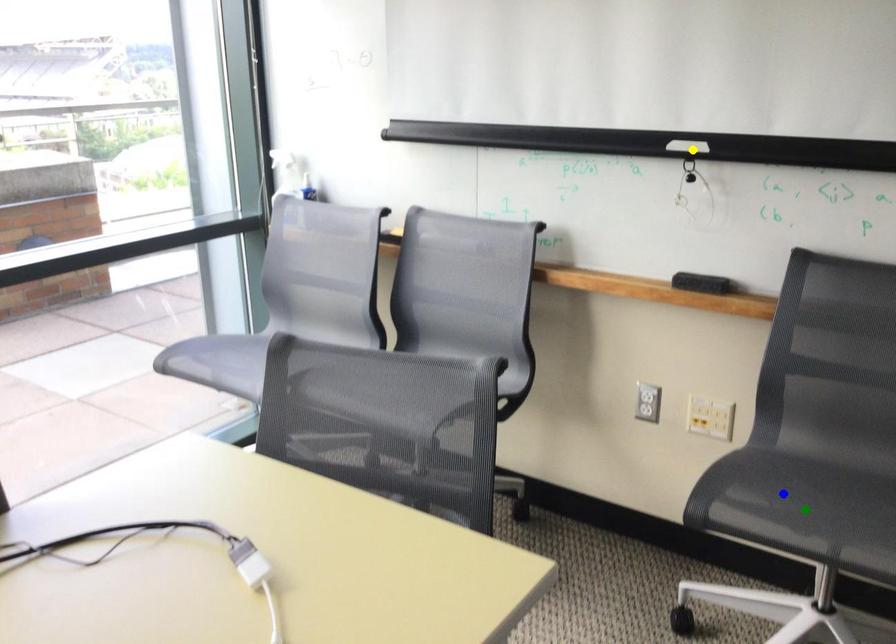
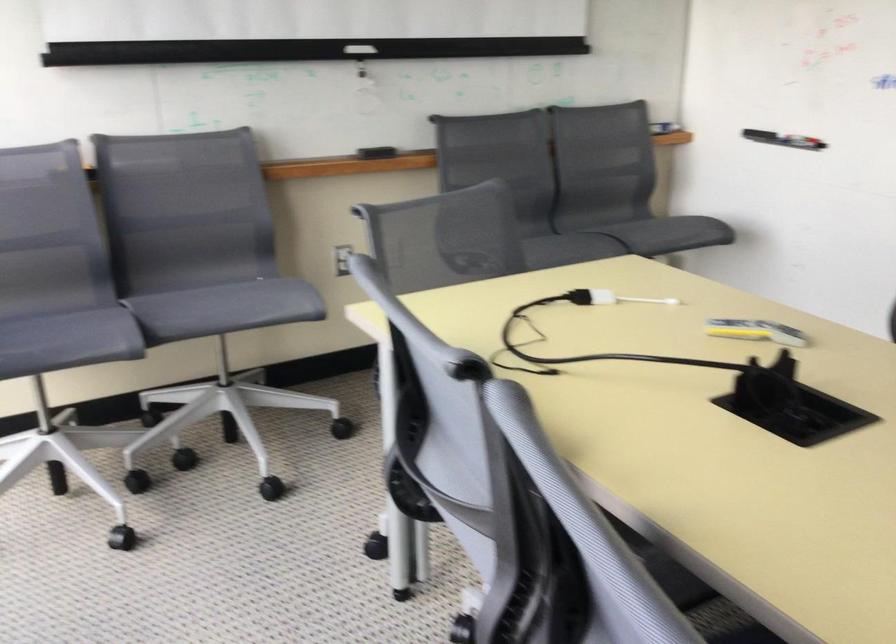
I am providing you with two images of the same scene from different viewpoints. Three points are marked in image1. Which point corresponds to a part or object that is occluded in image2?In image1, three points are marked. Which of them correspond to a part or object that is occluded in image2?Among the three points shown in image1, which one corresponds to a part or object that is no longer visible due to occlusion in image2?

Invisible in image2: blue point.